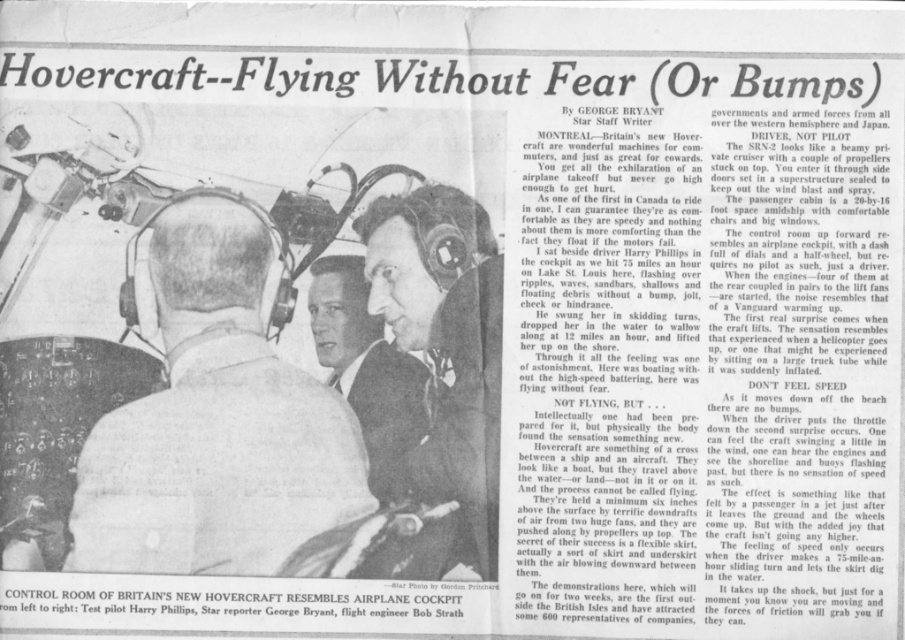
Question: Which of the following is the closest to the observer?

Choices:
 (A) (246, 516)
 (B) (346, 378)

Answer: (A)

Question: Which object appears closest to the camera in this image?

Choices:
 (A) white leather jacket at center
 (B) light brown suit jacket at center
 (C) matte black helmet at center

Answer: (A)

Question: Observing the image, what is the correct spatial positioning of white leather jacket at center in reference to light brown suit jacket at center?

Choices:
 (A) above
 (B) below

Answer: (B)

Question: Does matte black helmet at center appear under light brown suit jacket at center?

Choices:
 (A) yes
 (B) no

Answer: (A)

Question: Which of the following is the farthest from the observer?

Choices:
 (A) (344, 460)
 (B) (418, 385)
 (C) (477, 445)

Answer: (B)

Question: Does matte black helmet at center come behind light brown suit jacket at center?

Choices:
 (A) no
 (B) yes

Answer: (A)